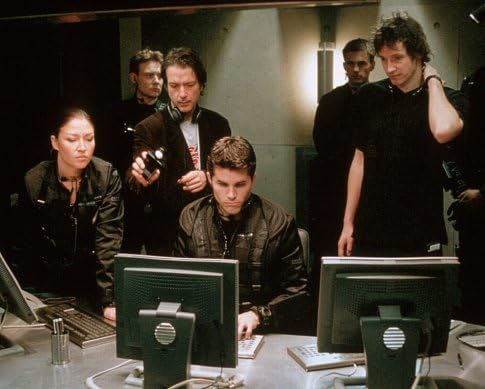
The width and height of the screenshot is (485, 389). In order to click on computer monitors in this screenshot , I will do `click(189, 311)`, `click(16, 303)`, `click(345, 297)`.